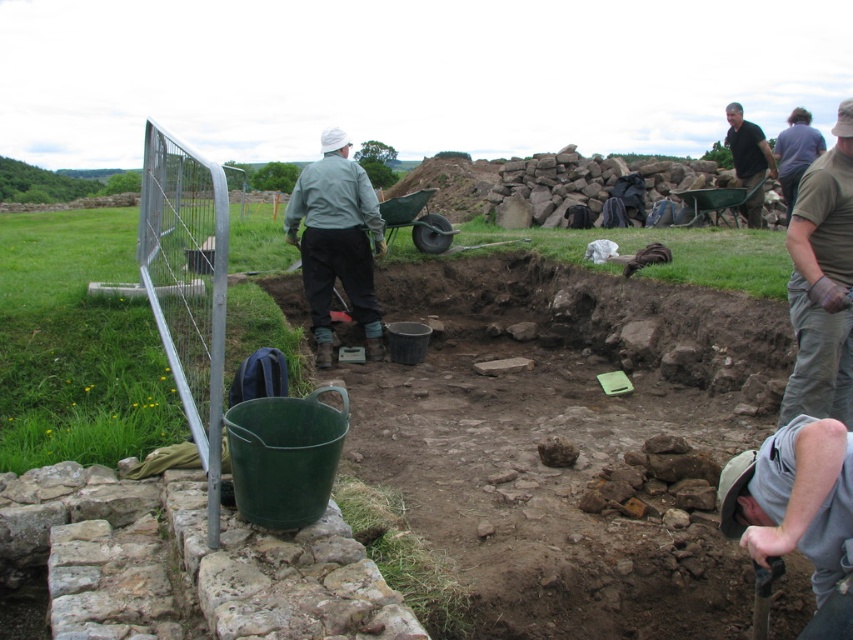
Question: Which object is positioned farthest from the green cotton shirt at upper right?

Choices:
 (A) light gray fabric jacket at center
 (B) black cotton shirt at upper right

Answer: (B)

Question: Which point is farther from the camera taking this photo?

Choices:
 (A) (763, 442)
 (B) (323, 364)
 (C) (825, 392)

Answer: (B)

Question: From the image, what is the correct spatial relationship of green cotton shirt at upper right in relation to light gray fabric jacket at center?

Choices:
 (A) below
 (B) above

Answer: (A)

Question: Which of the following is the closest to the observer?

Choices:
 (A) light gray fabric jacket at center
 (B) black cotton shirt at upper right
 (C) gray fabric shirt at lower right

Answer: (C)

Question: Does gray fabric shirt at lower right appear over light gray fabric jacket at center?

Choices:
 (A) no
 (B) yes

Answer: (A)

Question: Does light gray fabric jacket at center have a larger size compared to black cotton shirt at upper right?

Choices:
 (A) no
 (B) yes

Answer: (A)